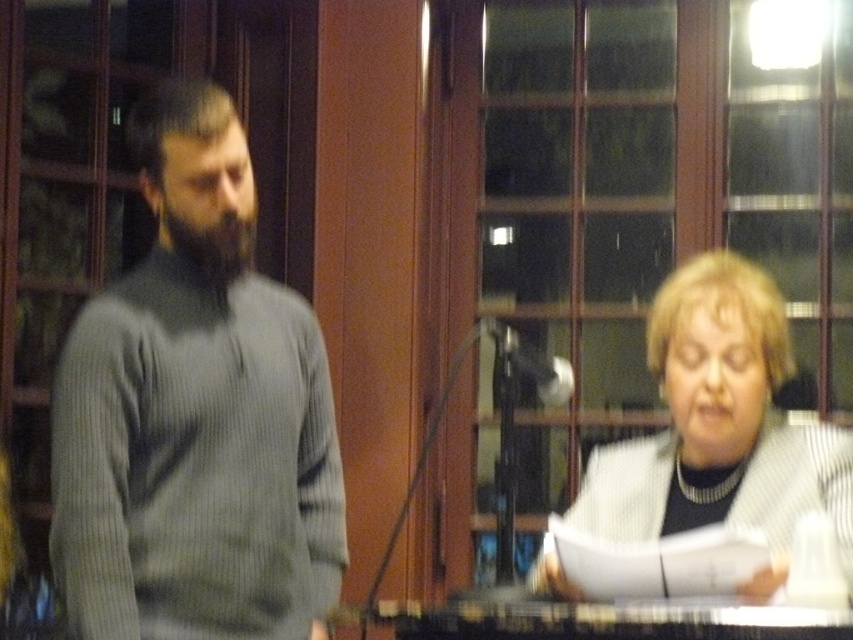
Based on the photo, you are designing a clothing rack for a store. The gray ribbed sweater at left and the white textured sweater at lower right need to be displayed. Which sweater should be placed on the narrower hanger to fit properly?

The gray ribbed sweater at left is thinner than the white textured sweater at lower right, so it should be placed on the narrower hanger to fit properly.